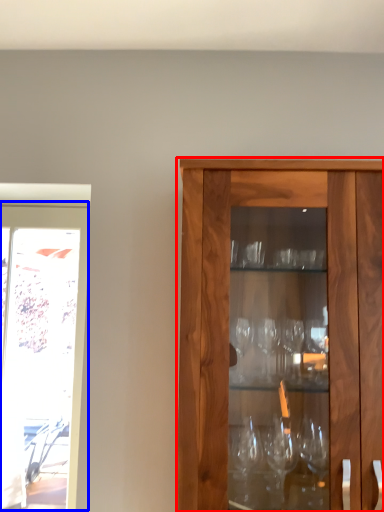
Question: Which object is further to the camera taking this photo, cabinetry (highlighted by a red box) or screen door (highlighted by a blue box)?

Choices:
 (A) cabinetry
 (B) screen door

Answer: (B)